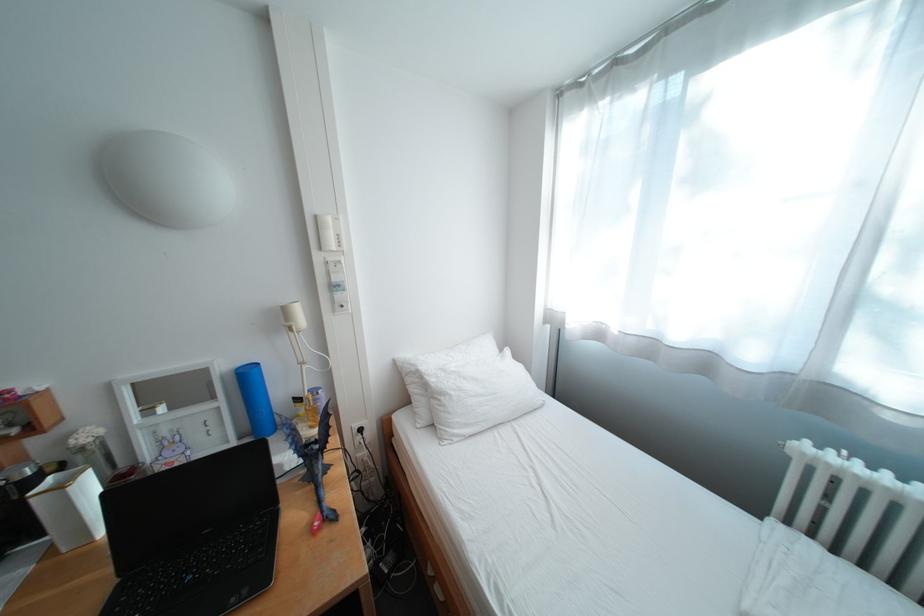
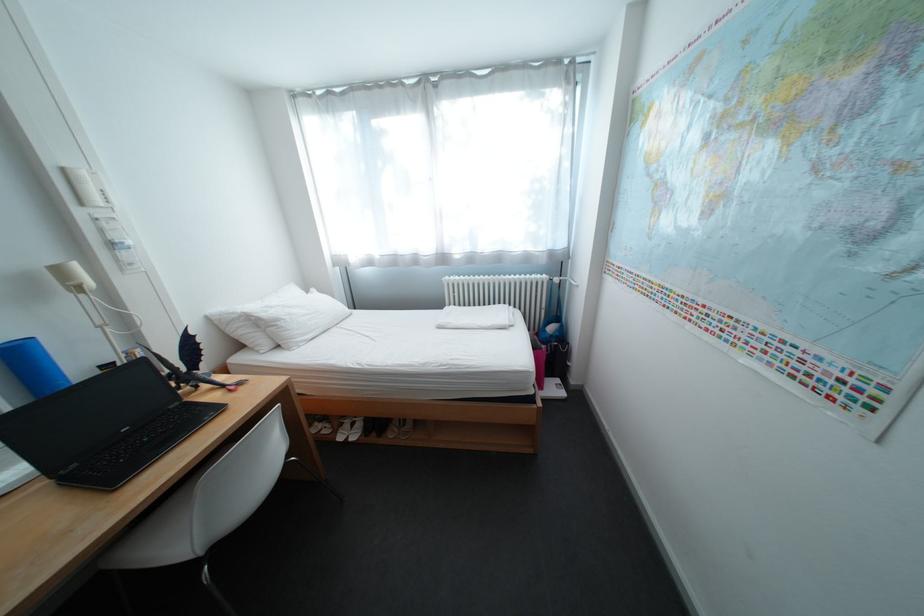
Locate, in the second image, the point that corresponds to pixel 329 219 in the first image.

(76, 171)